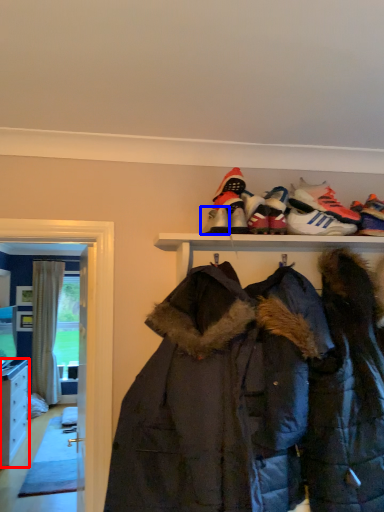
Question: Among these objects, which one is farthest to the camera, cabinetry (highlighted by a red box) or footwear (highlighted by a blue box)?

Choices:
 (A) cabinetry
 (B) footwear

Answer: (A)